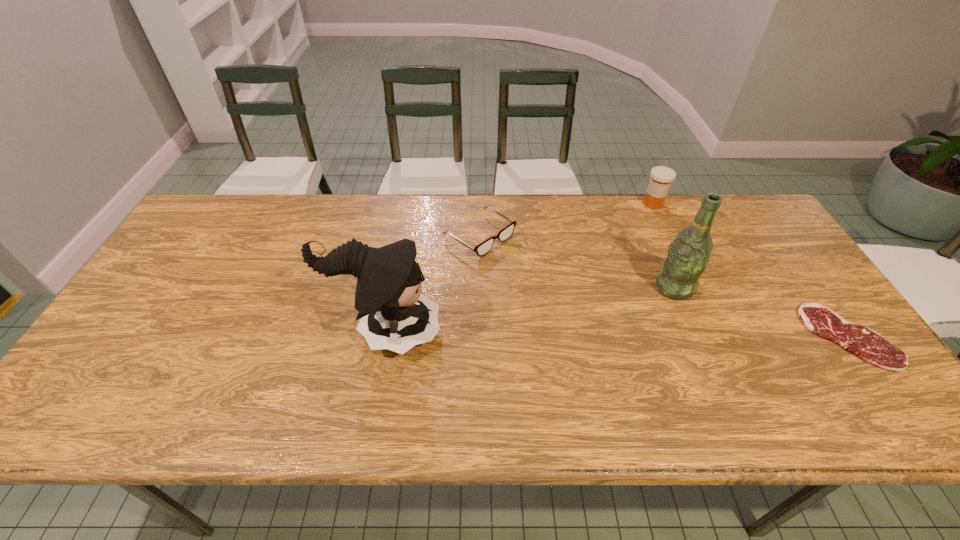
This screenshot has height=540, width=960. In order to click on doll in this screenshot , I will do `click(394, 314)`.

This screenshot has height=540, width=960. I want to click on the rightmost object, so click(x=867, y=344).

Where is `steak`? Image resolution: width=960 pixels, height=540 pixels. steak is located at coordinates (867, 344).

The height and width of the screenshot is (540, 960). Find the location of `the farthest object`. the farthest object is located at coordinates (661, 177).

Locate an element on the screen. The width and height of the screenshot is (960, 540). the third tallest object is located at coordinates (661, 177).

Where is `the second farthest object`? The image size is (960, 540). the second farthest object is located at coordinates (483, 248).

I want to click on the fourth tallest object, so click(x=483, y=248).

Find the location of `beer bottle`. beer bottle is located at coordinates (688, 255).

You are a GUI agent. You are given a task and a screenshot of the screen. Output one action in this format:
    pyautogui.click(x=<x>, y=<y>)
    Task: Click on the free spot located at the face of the doll
    This screenshot has width=960, height=540.
    Given the screenshot: What is the action you would take?
    pyautogui.click(x=541, y=332)

The width and height of the screenshot is (960, 540). What are the coordinates of `free space located on the back of the shortest object` in the screenshot? It's located at (794, 261).